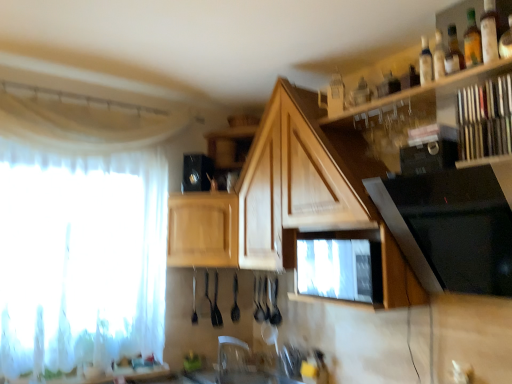
Question: From the image's perspective, is wooden books at upper right, the first shelf when ordered from right to left, below translucent glass bottle at upper right, arranged as the 2th bottle when viewed from the left?

Choices:
 (A) yes
 (B) no

Answer: (A)

Question: Would you say translucent glass bottle at upper right, which appears as the 1th bottle when viewed from the front, is part of wooden books at upper right, the first shelf when ordered from right to left,'s contents?

Choices:
 (A) yes
 (B) no

Answer: (B)

Question: Does wooden books at upper right, the first shelf when ordered from right to left, have a greater height compared to translucent glass bottle at upper right, arranged as the 2th bottle when viewed from the left?

Choices:
 (A) yes
 (B) no

Answer: (A)

Question: Is wooden books at upper right, the first shelf when ordered from right to left, wider than translucent glass bottle at upper right, which appears as the 1th bottle when viewed from the front?

Choices:
 (A) yes
 (B) no

Answer: (A)

Question: Can you confirm if wooden books at upper right, which appears as the second shelf when viewed from the left, is positioned to the left of translucent glass bottle at upper right, which appears as the 1th bottle when viewed from the front?

Choices:
 (A) yes
 (B) no

Answer: (B)

Question: Is the position of wooden books at upper right, which appears as the second shelf when viewed from the left, less distant than that of translucent glass bottle at upper right, which is counted as the first bottle, starting from the right?

Choices:
 (A) yes
 (B) no

Answer: (A)

Question: Can you confirm if wooden cabinet at center, acting as the 1th cabinetry starting from the right, is wider than black glass stove at upper right, the 3th appliance positioned from the back?

Choices:
 (A) no
 (B) yes

Answer: (B)

Question: Is wooden cabinet at center, acting as the 1th cabinetry starting from the right, next to black glass stove at upper right, the 1th appliance from the right?

Choices:
 (A) yes
 (B) no

Answer: (B)

Question: Considering the relative positions of wooden cabinet at center, which is the 2th cabinetry from left to right, and black glass stove at upper right, the 3th appliance positioned from the back, in the image provided, is wooden cabinet at center, which is the 2th cabinetry from left to right, to the right of black glass stove at upper right, the 3th appliance positioned from the back, from the viewer's perspective?

Choices:
 (A) yes
 (B) no

Answer: (B)

Question: Can you confirm if wooden cabinet at center, which is the 2th cabinetry from left to right, is positioned to the left of black glass stove at upper right, the 3th appliance positioned from the back?

Choices:
 (A) yes
 (B) no

Answer: (A)

Question: From a real-world perspective, is wooden cabinet at center, acting as the 1th cabinetry starting from the right, positioned over black glass stove at upper right, the 3th appliance in the left-to-right sequence, based on gravity?

Choices:
 (A) no
 (B) yes

Answer: (B)

Question: Is wooden cabinet at center, which is the 2th cabinetry from left to right, far away from black glass stove at upper right, the 1th appliance from the right?

Choices:
 (A) yes
 (B) no

Answer: (B)

Question: Does black glass stove at upper right, marked as the 1th appliance in a front-to-back arrangement, have a greater height compared to clear glass bottle at upper right, the first bottle viewed from the left?

Choices:
 (A) yes
 (B) no

Answer: (A)